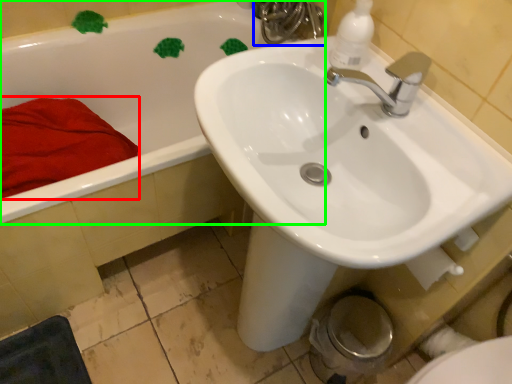
Question: Considering the real-world distances, which object is farthest from bath towel (highlighted by a red box)? plumbing fixture (highlighted by a blue box) or bathtub (highlighted by a green box)?

Choices:
 (A) plumbing fixture
 (B) bathtub

Answer: (A)